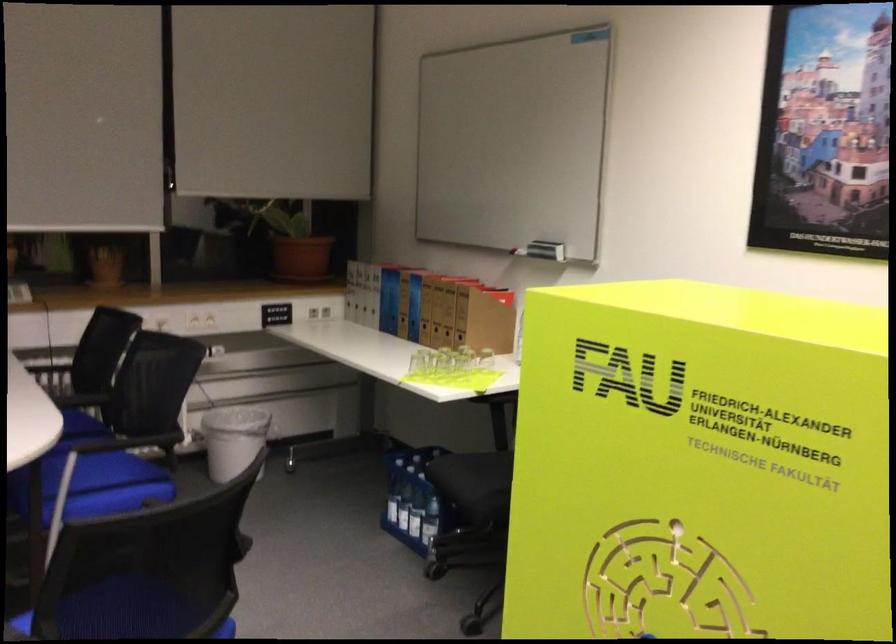
Where would you sit the blue chair sitting surface? Please return your answer as a coordinate pair (x, y).

(95, 485)